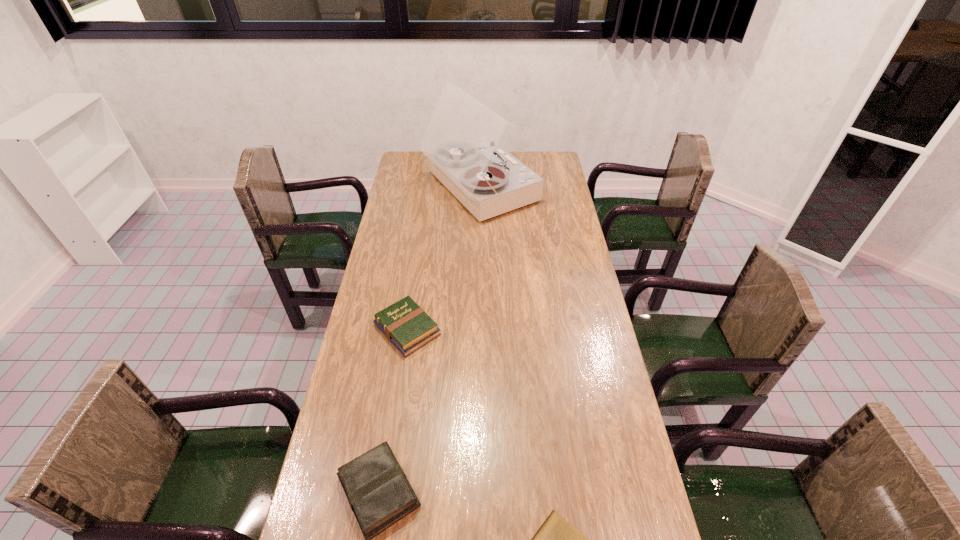
This screenshot has width=960, height=540. I want to click on record player, so click(461, 140).

At what (x,y) coordinates should I click in order to perform the action: click on the farthest object. Please return your answer as a coordinate pair (x, y). Looking at the image, I should click on pyautogui.click(x=461, y=140).

This screenshot has height=540, width=960. I want to click on the second farthest object, so click(x=406, y=325).

You are a GUI agent. You are given a task and a screenshot of the screen. Output one action in this format:
    pyautogui.click(x=<x>, y=<y>)
    Task: Click on the blank space located 0.380m on the front of the farthest object
    The image size is (960, 540).
    Given the screenshot: What is the action you would take?
    pyautogui.click(x=478, y=294)

Identify the location of blank space located 0.070m on the back of the second farthest object. This screenshot has width=960, height=540. (414, 289).

Where is `object present at the far edge`? This screenshot has height=540, width=960. object present at the far edge is located at coordinates (461, 140).

You are a GUI agent. You are given a task and a screenshot of the screen. Output one action in this format:
    pyautogui.click(x=<x>, y=<y>)
    Task: Click on the record player situated at the left edge
    This screenshot has width=960, height=540.
    Given the screenshot: What is the action you would take?
    pyautogui.click(x=461, y=140)

Identify the location of book that is positioned at the left edge. (406, 325).

Where is `object at the right edge`? object at the right edge is located at coordinates (461, 140).

At what (x,y) coordinates should I click in order to perform the action: click on object that is at the far left corner. Please return your answer as a coordinate pair (x, y). The image size is (960, 540). Looking at the image, I should click on (461, 140).